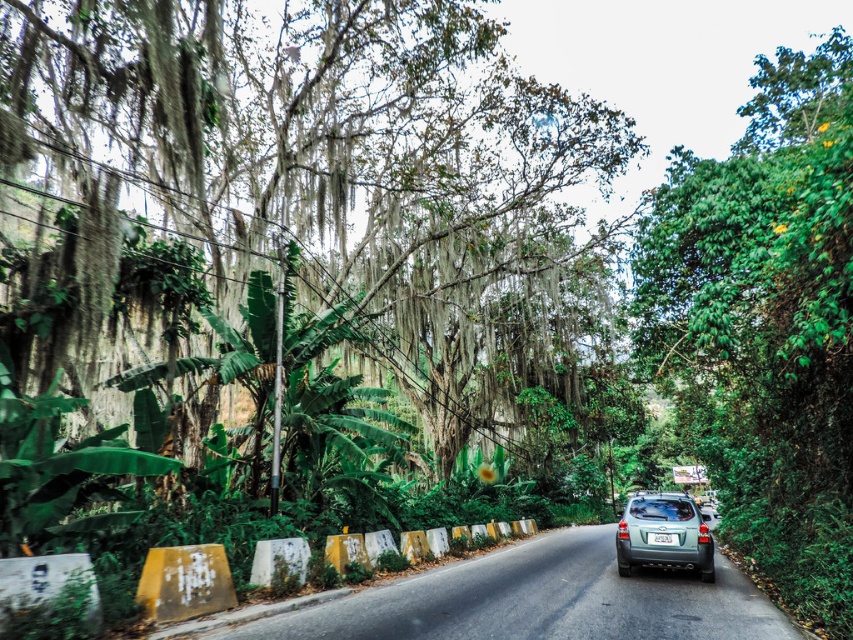
You are a pedestrian standing on the side of the road in the image. You want to cross the road to reach the dense foliage on the right. The yellow painted concrete barriers at lower center are in your way. Can you safely step over them?

The yellow painted concrete barriers at lower center are 4.97 meters away from you. Since the barriers are part of the road infrastructure, you should not attempt to step over them as it could be dangerous. Instead, look for a designated crossing area or follow traffic rules to cross safely.

You are driving a car and see a green leafy tree at right and a white plastic license plate at center. Which object is located to the right of the other?

The green leafy tree at right is positioned on the right side of the white plastic license plate at center.

You are a driver looking at the road ahead. You notice a green leafy tree at right and a white plastic license plate at center. Which object is bigger in the scene?

The green leafy tree at right has a larger size compared to the white plastic license plate at center, so the green leafy tree at right is bigger.